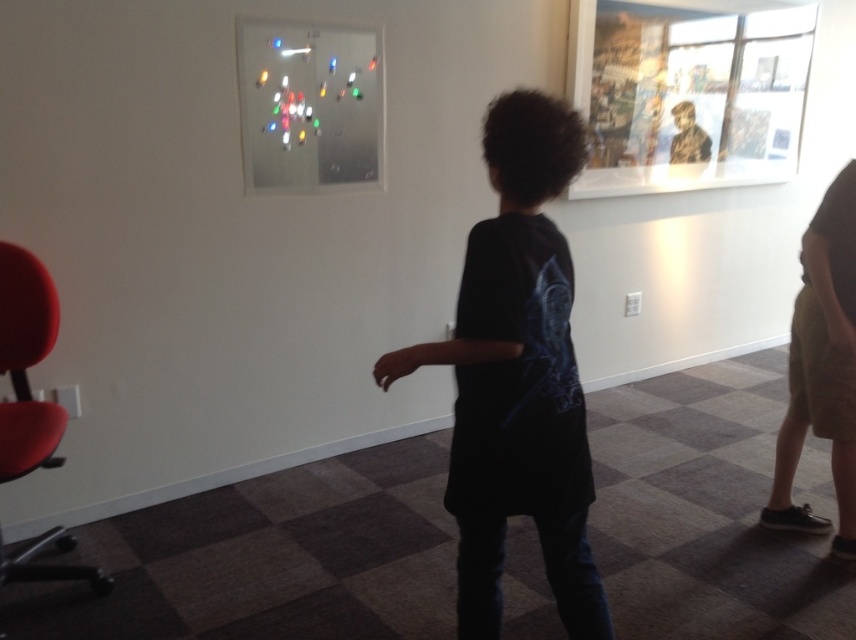
Question: Which of these objects is positioned farthest from the camouflage fabric poster at upper right?

Choices:
 (A) dark blue t-shirt at center
 (B) matte red swivel chair at left

Answer: (B)

Question: Estimate the real-world distances between objects in this image. Which object is closer to the camouflage fabric poster at upper right?

Choices:
 (A) dark blue t-shirt at center
 (B) matte red swivel chair at left

Answer: (A)

Question: Can you confirm if dark blue t-shirt at center is positioned to the left of camouflage fabric poster at upper right?

Choices:
 (A) yes
 (B) no

Answer: (A)

Question: Which object is closer to the camera taking this photo?

Choices:
 (A) matte red swivel chair at left
 (B) dark blue t-shirt at center
 (C) camouflage fabric poster at upper right

Answer: (B)

Question: Does dark blue t-shirt at center have a smaller size compared to camouflage fabric poster at upper right?

Choices:
 (A) yes
 (B) no

Answer: (A)

Question: Is dark blue t-shirt at center closer to the viewer compared to matte red swivel chair at left?

Choices:
 (A) no
 (B) yes

Answer: (B)